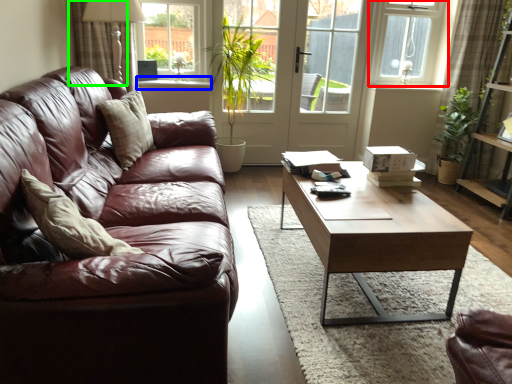
Question: Which object is the farthest from window (highlighted by a red box)? Choose among these: window sill (highlighted by a blue box) or curtain (highlighted by a green box).

Choices:
 (A) window sill
 (B) curtain

Answer: (B)